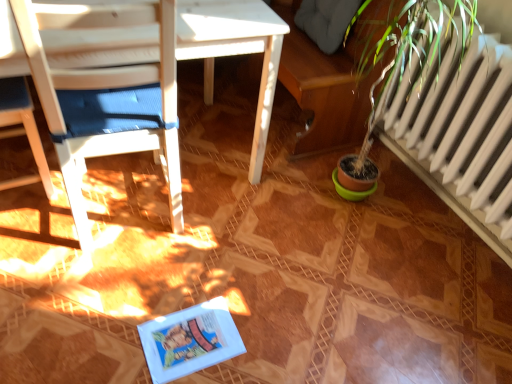
Question: From the image's perspective, is white wood chair at left, positioned as the second chair in left-to-right order, over white wood chair at left, which ranks as the first chair in left-to-right order?

Choices:
 (A) no
 (B) yes

Answer: (A)

Question: Considering the relative positions of white wood chair at left, positioned as the second chair in left-to-right order, and white wood chair at left, which ranks as the first chair in left-to-right order, in the image provided, is white wood chair at left, positioned as the second chair in left-to-right order, to the right of white wood chair at left, which ranks as the first chair in left-to-right order, from the viewer's perspective?

Choices:
 (A) no
 (B) yes

Answer: (B)

Question: From the image's perspective, is white wood chair at left, positioned as the second chair in left-to-right order, located beneath white wood chair at left, which ranks as the first chair in left-to-right order?

Choices:
 (A) yes
 (B) no

Answer: (A)

Question: Is white wood chair at left, positioned as the second chair in left-to-right order, facing towards white wood chair at left, which ranks as the first chair in left-to-right order?

Choices:
 (A) no
 (B) yes

Answer: (A)

Question: Is white wood chair at left, acting as the 1th chair starting from the right, closer to camera compared to white wood chair at left, which ranks as the first chair in left-to-right order?

Choices:
 (A) yes
 (B) no

Answer: (A)

Question: Does white wood chair at left, positioned as the second chair in left-to-right order, have a lesser width compared to white wood chair at left, which ranks as the first chair in left-to-right order?

Choices:
 (A) yes
 (B) no

Answer: (B)

Question: Are white wood chair at left, positioned as the 2th chair in right-to-left order, and white wood chair at left, positioned as the second chair in left-to-right order, far apart?

Choices:
 (A) yes
 (B) no

Answer: (B)

Question: Considering the relative positions of white wood chair at left, positioned as the 2th chair in right-to-left order, and white wood chair at left, acting as the 1th chair starting from the right, in the image provided, is white wood chair at left, positioned as the 2th chair in right-to-left order, to the left of white wood chair at left, acting as the 1th chair starting from the right, from the viewer's perspective?

Choices:
 (A) no
 (B) yes

Answer: (B)

Question: Is white wood chair at left, which ranks as the first chair in left-to-right order, wider than white wood chair at left, positioned as the second chair in left-to-right order?

Choices:
 (A) yes
 (B) no

Answer: (B)

Question: From a real-world perspective, is white wood chair at left, which ranks as the first chair in left-to-right order, physically above white wood chair at left, acting as the 1th chair starting from the right?

Choices:
 (A) no
 (B) yes

Answer: (A)

Question: From the image's perspective, is white wood chair at left, positioned as the 2th chair in right-to-left order, located above white wood chair at left, positioned as the second chair in left-to-right order?

Choices:
 (A) no
 (B) yes

Answer: (B)

Question: Can you confirm if white wood chair at left, positioned as the 2th chair in right-to-left order, is smaller than white wood chair at left, acting as the 1th chair starting from the right?

Choices:
 (A) yes
 (B) no

Answer: (A)

Question: In terms of height, does white wood chair at left, positioned as the 2th chair in right-to-left order, look taller or shorter compared to white wood chair at left, acting as the 1th chair starting from the right?

Choices:
 (A) tall
 (B) short

Answer: (B)